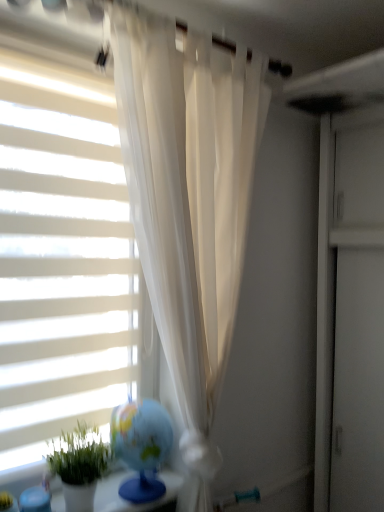
Question: Does white matte window blind at left have a greater height compared to green matte plant at lower left?

Choices:
 (A) no
 (B) yes

Answer: (B)

Question: Is white matte window blind at left not close to green matte plant at lower left?

Choices:
 (A) yes
 (B) no

Answer: (B)

Question: Is white matte window blind at left closer to camera compared to green matte plant at lower left?

Choices:
 (A) yes
 (B) no

Answer: (B)

Question: From a real-world perspective, is white matte window blind at left located beneath green matte plant at lower left?

Choices:
 (A) no
 (B) yes

Answer: (A)

Question: Is white matte window blind at left wider than green matte plant at lower left?

Choices:
 (A) no
 (B) yes

Answer: (A)

Question: Would you say white matte window blind at left contains green matte plant at lower left?

Choices:
 (A) yes
 (B) no

Answer: (B)

Question: From the image's perspective, would you say green matte plant at lower left is positioned over white matte window blind at left?

Choices:
 (A) no
 (B) yes

Answer: (A)

Question: Is green matte plant at lower left turned away from white matte window blind at left?

Choices:
 (A) no
 (B) yes

Answer: (B)

Question: Is the depth of green matte plant at lower left less than that of white matte window blind at left?

Choices:
 (A) no
 (B) yes

Answer: (B)

Question: Are green matte plant at lower left and white matte window blind at left far apart?

Choices:
 (A) yes
 (B) no

Answer: (B)

Question: Could you tell me if green matte plant at lower left is turned towards white matte window blind at left?

Choices:
 (A) no
 (B) yes

Answer: (A)

Question: Can you confirm if green matte plant at lower left is thinner than white matte window blind at left?

Choices:
 (A) no
 (B) yes

Answer: (A)

Question: In the image, is white matte window blind at left positioned in front of or behind green matte plant at lower left?

Choices:
 (A) front
 (B) behind

Answer: (B)